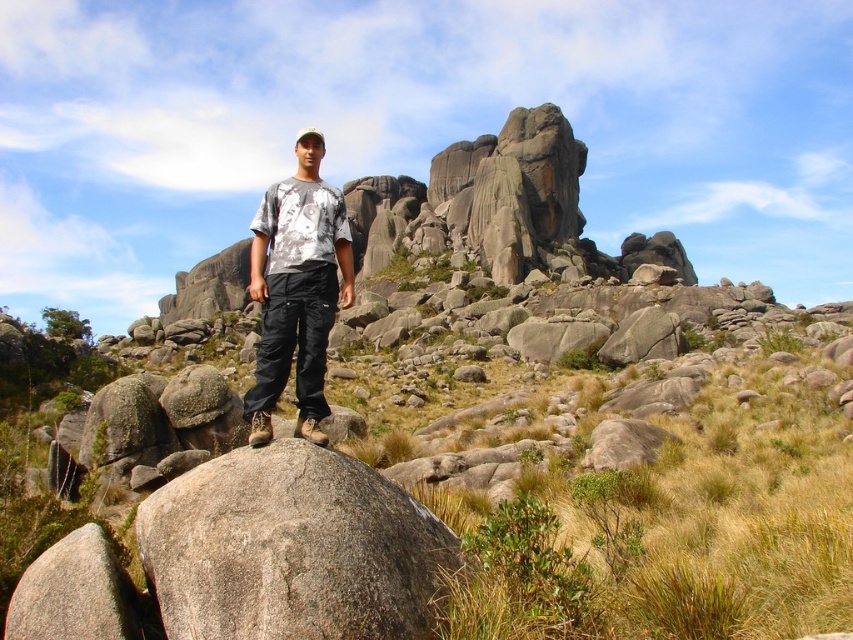
Question: Can you confirm if gray rough boulder at center is bigger than matte gray t-shirt at center?

Choices:
 (A) yes
 (B) no

Answer: (B)

Question: Among these objects, which one is nearest to the camera?

Choices:
 (A) gray rough boulder at center
 (B) matte gray t-shirt at center

Answer: (A)

Question: Is gray rough boulder at center further to camera compared to matte gray t-shirt at center?

Choices:
 (A) yes
 (B) no

Answer: (B)

Question: Among these objects, which one is nearest to the camera?

Choices:
 (A) gray rough boulder at center
 (B) matte gray t-shirt at center

Answer: (A)

Question: Observing the image, what is the correct spatial positioning of gray rough boulder at center in reference to matte gray t-shirt at center?

Choices:
 (A) below
 (B) above

Answer: (A)